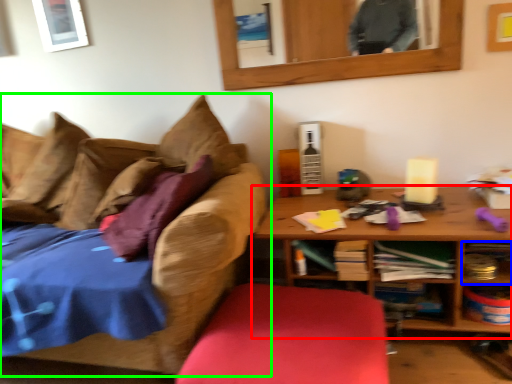
Question: Which object is the farthest from table (highlighted by a red box)? Choose among these: shelf (highlighted by a blue box) or studio couch (highlighted by a green box).

Choices:
 (A) shelf
 (B) studio couch

Answer: (B)